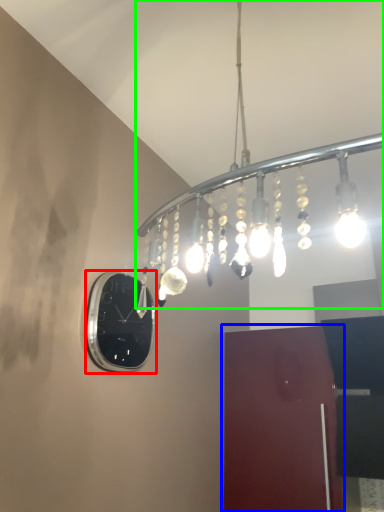
Question: Which is nearer to the clock (highlighted by a red box)? door (highlighted by a blue box) or lamp (highlighted by a green box).

Choices:
 (A) door
 (B) lamp

Answer: (B)